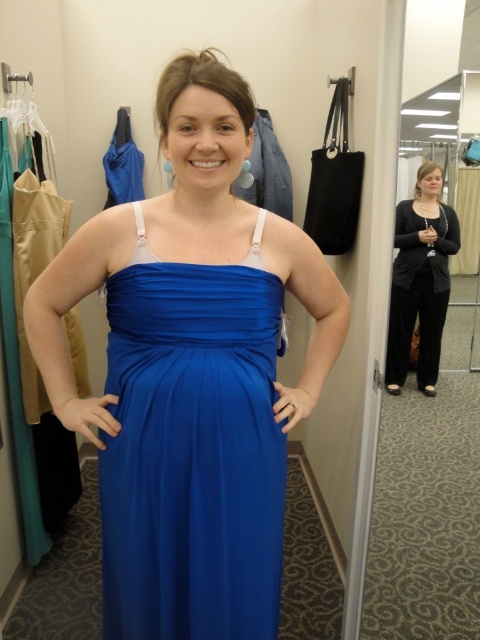
Question: Is royal satin dress at center positioned before royal blue satin dress at center?

Choices:
 (A) no
 (B) yes

Answer: (B)

Question: Which of the following is the farthest from the observer?

Choices:
 (A) (347, 310)
 (B) (136, 365)

Answer: (A)

Question: Considering the real-world distances, which object is closest to the royal blue satin dress at center?

Choices:
 (A) royal satin dress at center
 (B) black matte cardigan at center

Answer: (A)

Question: Is royal blue satin dress at center thinner than black matte cardigan at center?

Choices:
 (A) no
 (B) yes

Answer: (B)

Question: Does royal satin dress at center appear on the left side of royal blue satin dress at center?

Choices:
 (A) no
 (B) yes

Answer: (B)

Question: Based on their relative distances, which object is nearer to the black matte cardigan at center?

Choices:
 (A) royal blue satin dress at center
 (B) royal satin dress at center

Answer: (B)